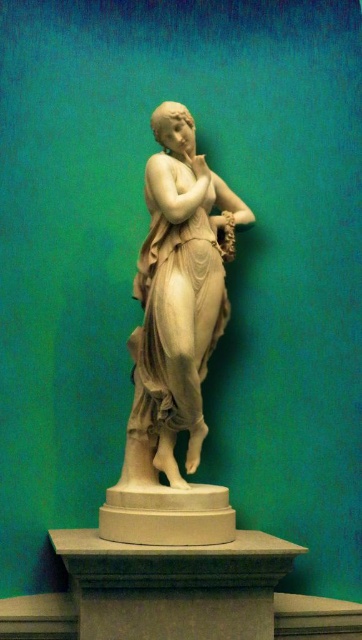
Question: Can you confirm if white marble statue at center is positioned below smooth stone pedestal at center?

Choices:
 (A) no
 (B) yes

Answer: (A)

Question: Considering the relative positions of white marble statue at center and smooth stone pedestal at center in the image provided, where is white marble statue at center located with respect to smooth stone pedestal at center?

Choices:
 (A) above
 (B) below

Answer: (A)

Question: Which point is farther to the camera?

Choices:
 (A) (237, 563)
 (B) (195, 260)

Answer: (B)

Question: Is white marble statue at center below smooth stone pedestal at center?

Choices:
 (A) yes
 (B) no

Answer: (B)

Question: Among these objects, which one is farthest from the camera?

Choices:
 (A) white marble statue at center
 (B) smooth stone pedestal at center

Answer: (A)

Question: Which object is farther from the camera taking this photo?

Choices:
 (A) white marble statue at center
 (B) smooth stone pedestal at center

Answer: (A)